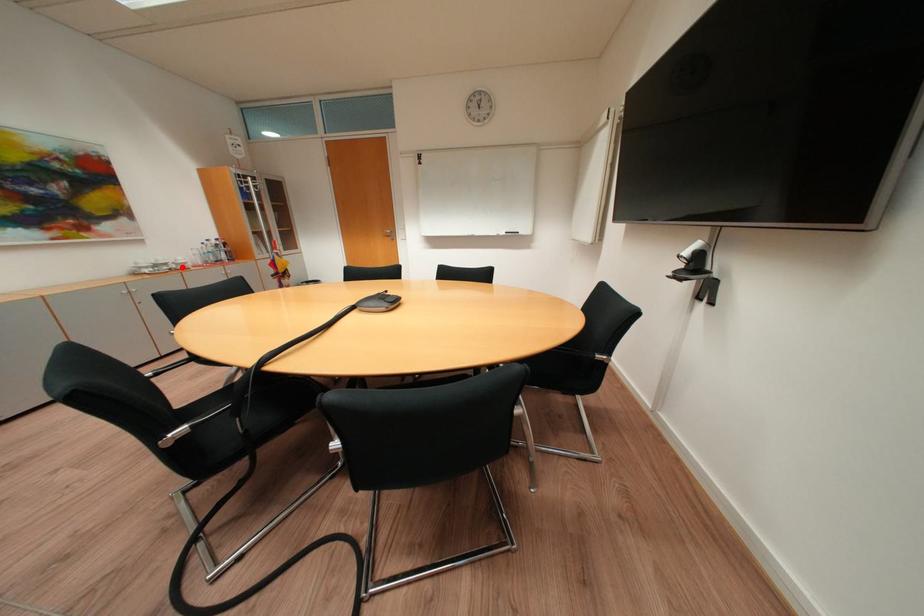
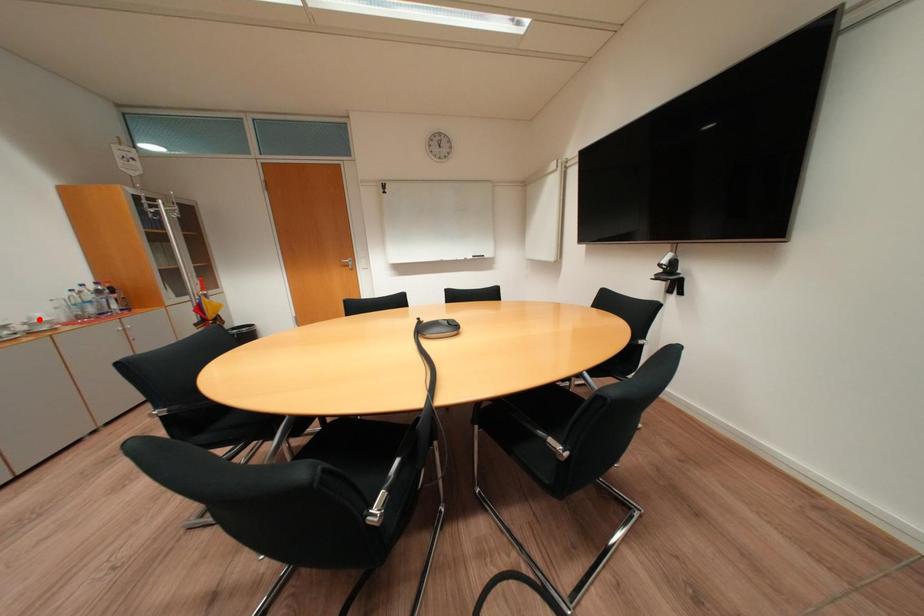
I am providing you with two images of the same scene from different viewpoints. A red point is marked on the first image and another point is marked on the second image. Does the point marked in image1 correspond to the same location as the one in image2?

No